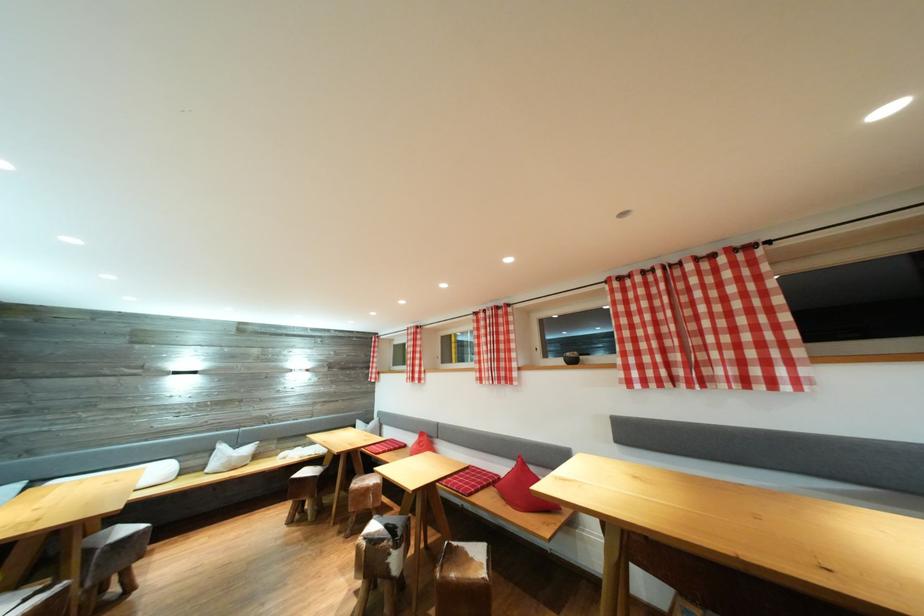
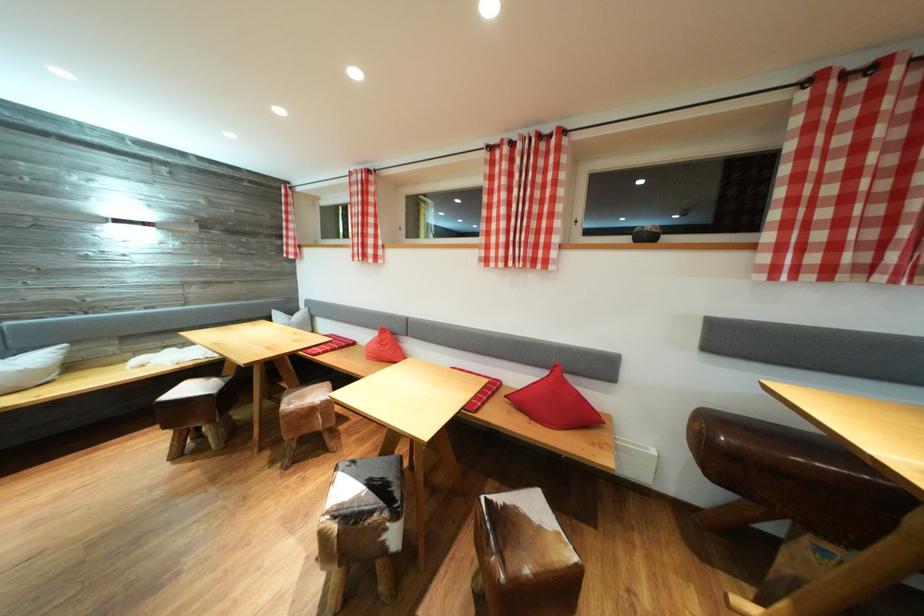
In the second image, find the point that corresponds to the point at 403,552 in the first image.

(403, 522)